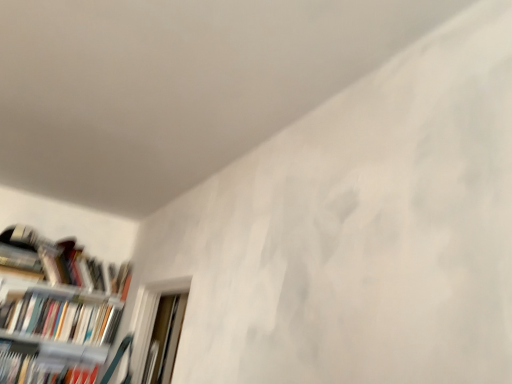
Image resolution: width=512 pixels, height=384 pixels. What are the coordinates of `white glossy bookshelf at left, acting as the 2th book starting from the top` in the screenshot? It's located at (62, 317).

Describe the element at coordinates (56, 310) in the screenshot. I see `white plastic bookcase at lower left` at that location.

The width and height of the screenshot is (512, 384). Describe the element at coordinates (60, 264) in the screenshot. I see `hardcover book at left, the third book from the bottom` at that location.

Find the location of a particular element. This screenshot has width=512, height=384. white glossy bookshelf at left, acting as the 2th book starting from the top is located at coordinates (62, 317).

In the scene shown: Who is more distant, hardcover book at lower left, positioned as the third book in top-to-bottom order, or hardcover book at left, the third book from the bottom?

hardcover book at left, the third book from the bottom.

Is hardcover book at lower left, the 1th book from the bottom, touching hardcover book at left, the third book from the bottom?

No, hardcover book at lower left, the 1th book from the bottom, is not making contact with hardcover book at left, the third book from the bottom.

Which is closer, (59, 379) or (26, 253)?

Point (59, 379).

Is hardcover book at lower left, positioned as the third book in top-to-bottom order, aimed at hardcover book at left, marked as the first book in a top-to-bottom arrangement?

No, hardcover book at lower left, positioned as the third book in top-to-bottom order, is not facing towards hardcover book at left, marked as the first book in a top-to-bottom arrangement.

Looking at this image, in the image, is white glossy bookshelf at left, placed as the 2th book when sorted from bottom to top, positioned in front of or behind hardcover book at left, the third book from the bottom?

white glossy bookshelf at left, placed as the 2th book when sorted from bottom to top, is positioned closer to the viewer than hardcover book at left, the third book from the bottom.

Is white glossy bookshelf at left, acting as the 2th book starting from the top, positioned far away from hardcover book at left, marked as the first book in a top-to-bottom arrangement?

white glossy bookshelf at left, acting as the 2th book starting from the top, is actually quite close to hardcover book at left, marked as the first book in a top-to-bottom arrangement.

Is point (0, 322) closer to viewer compared to point (47, 261)?

Yes, it is.

From their relative heights in the image, would you say white glossy bookshelf at left, placed as the 2th book when sorted from bottom to top, is taller or shorter than hardcover book at left, marked as the first book in a top-to-bottom arrangement?

Clearly, white glossy bookshelf at left, placed as the 2th book when sorted from bottom to top, is taller compared to hardcover book at left, marked as the first book in a top-to-bottom arrangement.

Between hardcover book at lower left, positioned as the third book in top-to-bottom order, and white glossy bookshelf at left, acting as the 2th book starting from the top, which one has smaller width?

hardcover book at lower left, positioned as the third book in top-to-bottom order.

Considering the relative positions of hardcover book at lower left, the 1th book from the bottom, and white glossy bookshelf at left, placed as the 2th book when sorted from bottom to top, in the image provided, is hardcover book at lower left, the 1th book from the bottom, to the left of white glossy bookshelf at left, placed as the 2th book when sorted from bottom to top, from the viewer's perspective?

Yes.

Could you tell me if hardcover book at lower left, the 1th book from the bottom, is turned towards white glossy bookshelf at left, acting as the 2th book starting from the top?

No, hardcover book at lower left, the 1th book from the bottom, is not turned towards white glossy bookshelf at left, acting as the 2th book starting from the top.

From a real-world perspective, is hardcover book at lower left, the 1th book from the bottom, located higher than white glossy bookshelf at left, acting as the 2th book starting from the top?

No.

Does hardcover book at left, marked as the first book in a top-to-bottom arrangement, have a lesser height compared to hardcover book at lower left, the 1th book from the bottom?

In fact, hardcover book at left, marked as the first book in a top-to-bottom arrangement, may be taller than hardcover book at lower left, the 1th book from the bottom.

Measure the distance between hardcover book at left, the third book from the bottom, and hardcover book at lower left, the 1th book from the bottom.

The distance of hardcover book at left, the third book from the bottom, from hardcover book at lower left, the 1th book from the bottom, is 18.90 inches.

Which is more to the left, hardcover book at left, marked as the first book in a top-to-bottom arrangement, or hardcover book at lower left, positioned as the third book in top-to-bottom order?

From the viewer's perspective, hardcover book at lower left, positioned as the third book in top-to-bottom order, appears more on the left side.

Between hardcover book at left, marked as the first book in a top-to-bottom arrangement, and hardcover book at lower left, positioned as the third book in top-to-bottom order, which one is positioned in front?

Positioned in front is hardcover book at lower left, positioned as the third book in top-to-bottom order.

Considering their positions, is white plastic bookcase at lower left located in front of or behind white glossy bookshelf at left, placed as the 2th book when sorted from bottom to top?

white plastic bookcase at lower left is positioned closer to the viewer than white glossy bookshelf at left, placed as the 2th book when sorted from bottom to top.

From the image's perspective, is white plastic bookcase at lower left located above white glossy bookshelf at left, placed as the 2th book when sorted from bottom to top?

No, from the image's perspective, white plastic bookcase at lower left is not on top of white glossy bookshelf at left, placed as the 2th book when sorted from bottom to top.

Does white plastic bookcase at lower left appear on the right side of white glossy bookshelf at left, placed as the 2th book when sorted from bottom to top?

In fact, white plastic bookcase at lower left is to the left of white glossy bookshelf at left, placed as the 2th book when sorted from bottom to top.

Is hardcover book at left, the third book from the bottom, in contact with white plastic bookcase at lower left?

No, hardcover book at left, the third book from the bottom, is not making contact with white plastic bookcase at lower left.

Does hardcover book at left, the third book from the bottom, appear on the right side of white plastic bookcase at lower left?

Indeed, hardcover book at left, the third book from the bottom, is positioned on the right side of white plastic bookcase at lower left.

From the image's perspective, who appears lower, hardcover book at left, marked as the first book in a top-to-bottom arrangement, or white plastic bookcase at lower left?

white plastic bookcase at lower left.

Does hardcover book at left, marked as the first book in a top-to-bottom arrangement, have a greater width compared to white plastic bookcase at lower left?

No.

Which is more to the right, hardcover book at left, the third book from the bottom, or white glossy bookshelf at left, placed as the 2th book when sorted from bottom to top?

Positioned to the right is hardcover book at left, the third book from the bottom.

From the picture: From the image's perspective, is hardcover book at left, the third book from the bottom, above or below white glossy bookshelf at left, placed as the 2th book when sorted from bottom to top?

hardcover book at left, the third book from the bottom, is situated higher than white glossy bookshelf at left, placed as the 2th book when sorted from bottom to top, in the image.

From a real-world perspective, is hardcover book at left, the third book from the bottom, positioned above or below white glossy bookshelf at left, acting as the 2th book starting from the top?

In terms of real-world spatial position, hardcover book at left, the third book from the bottom, is above white glossy bookshelf at left, acting as the 2th book starting from the top.

Looking at the image, does hardcover book at left, the third book from the bottom, seem bigger or smaller compared to white glossy bookshelf at left, acting as the 2th book starting from the top?

In the image, hardcover book at left, the third book from the bottom, appears to be smaller than white glossy bookshelf at left, acting as the 2th book starting from the top.

Locate an element on the screen. This screenshot has width=512, height=384. book that is the 2nd object to the left of the hardcover book at left, marked as the first book in a top-to-bottom arrangement, starting at the anchor is located at coordinates (39, 367).

From a real-world perspective, starting from the hardcover book at left, marked as the first book in a top-to-bottom arrangement, which book is the 1st one below it? Please provide its 2D coordinates.

[(62, 317)]

Looking at the image, which one is located further to white glossy bookshelf at left, acting as the 2th book starting from the top, hardcover book at lower left, positioned as the third book in top-to-bottom order, or hardcover book at left, marked as the first book in a top-to-bottom arrangement?

Based on the image, hardcover book at lower left, positioned as the third book in top-to-bottom order, appears to be further to white glossy bookshelf at left, acting as the 2th book starting from the top.

Considering their positions, is hardcover book at left, marked as the first book in a top-to-bottom arrangement, positioned further to white glossy bookshelf at left, acting as the 2th book starting from the top, than hardcover book at lower left, positioned as the third book in top-to-bottom order?

The object further to white glossy bookshelf at left, acting as the 2th book starting from the top, is hardcover book at lower left, positioned as the third book in top-to-bottom order.

Considering their positions, is white glossy bookshelf at left, placed as the 2th book when sorted from bottom to top, positioned further to hardcover book at lower left, positioned as the third book in top-to-bottom order, than white plastic bookcase at lower left?

The object further to hardcover book at lower left, positioned as the third book in top-to-bottom order, is white glossy bookshelf at left, placed as the 2th book when sorted from bottom to top.

Considering their positions, is hardcover book at lower left, positioned as the third book in top-to-bottom order, positioned further to hardcover book at left, the third book from the bottom, than white glossy bookshelf at left, placed as the 2th book when sorted from bottom to top?

hardcover book at lower left, positioned as the third book in top-to-bottom order.

Based on their spatial positions, is hardcover book at left, marked as the first book in a top-to-bottom arrangement, or white glossy bookshelf at left, acting as the 2th book starting from the top, closer to white plastic bookcase at lower left?

white glossy bookshelf at left, acting as the 2th book starting from the top, is closer to white plastic bookcase at lower left.

Based on the photo, considering their positions, is hardcover book at lower left, the 1th book from the bottom, positioned further to white glossy bookshelf at left, placed as the 2th book when sorted from bottom to top, than white plastic bookcase at lower left?

hardcover book at lower left, the 1th book from the bottom.

Looking at the image, which one is located further to hardcover book at left, the third book from the bottom, white plastic bookcase at lower left or white glossy bookshelf at left, placed as the 2th book when sorted from bottom to top?

Among the two, white glossy bookshelf at left, placed as the 2th book when sorted from bottom to top, is located further to hardcover book at left, the third book from the bottom.

From the picture: Estimate the real-world distances between objects in this image. Which object is closer to hardcover book at left, marked as the first book in a top-to-bottom arrangement, white glossy bookshelf at left, placed as the 2th book when sorted from bottom to top, or hardcover book at lower left, the 1th book from the bottom?

white glossy bookshelf at left, placed as the 2th book when sorted from bottom to top, is closer to hardcover book at left, marked as the first book in a top-to-bottom arrangement.

Where is `bookcase between hardcover book at left, the third book from the bottom, and hardcover book at lower left, positioned as the third book in top-to-bottom order, in the vertical direction`? The image size is (512, 384). bookcase between hardcover book at left, the third book from the bottom, and hardcover book at lower left, positioned as the third book in top-to-bottom order, in the vertical direction is located at coordinates (56, 310).

You are a GUI agent. You are given a task and a screenshot of the screen. Output one action in this format:
    pyautogui.click(x=<x>, y=<y>)
    Task: Click on the bookcase between white glossy bookshelf at left, placed as the 2th book when sorted from bottom to top, and hardcover book at lower left, the 1th book from the bottom, from top to bottom
    The height and width of the screenshot is (384, 512).
    Given the screenshot: What is the action you would take?
    click(56, 310)

What are the coordinates of `book between hardcover book at left, marked as the first book in a top-to-bottom arrangement, and hardcover book at lower left, the 1th book from the bottom, in the vertical direction` in the screenshot? It's located at (62, 317).

The width and height of the screenshot is (512, 384). Identify the location of book between hardcover book at left, the third book from the bottom, and white plastic bookcase at lower left, in the vertical direction. (62, 317).